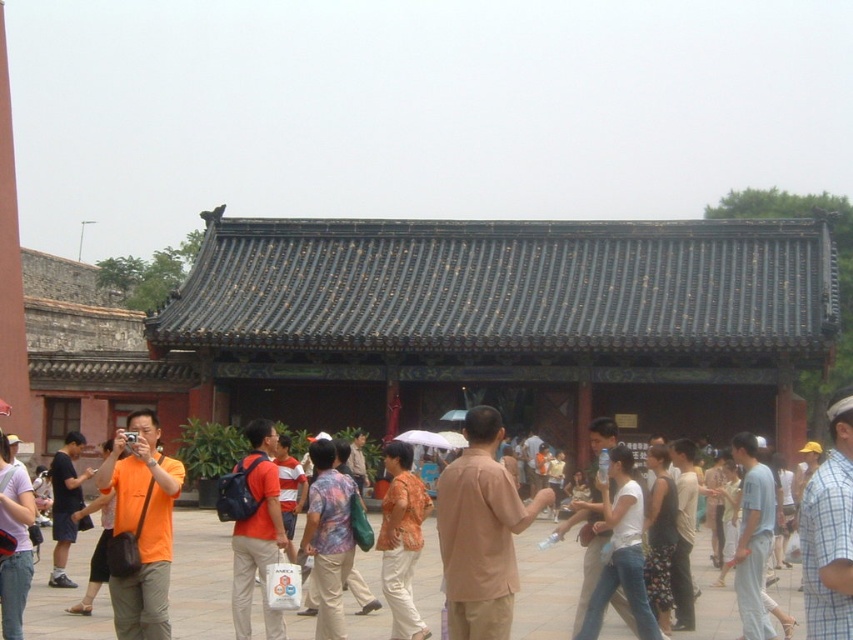
Question: Among these points, which one is farthest from the camera?

Choices:
 (A) (418, 520)
 (B) (653, 452)
 (C) (273, 461)
 (D) (631, 470)

Answer: (C)

Question: Is orange cotton shirt at center smaller than orange fabric backpack at center?

Choices:
 (A) yes
 (B) no

Answer: (B)

Question: Can you confirm if orange fabric backpack at center is positioned above orange t-shirt at left?

Choices:
 (A) no
 (B) yes

Answer: (B)

Question: Which point is closer to the camera?

Choices:
 (A) (410, 545)
 (B) (27, 531)
 (C) (252, 488)
 (D) (56, 484)

Answer: (B)

Question: Is printed cotton shirt at center positioned in front of white cotton shirt at center?

Choices:
 (A) yes
 (B) no

Answer: (A)

Question: Which point appears farthest from the camera in this image?

Choices:
 (A) (16, 468)
 (B) (653, 634)
 (C) (248, 522)
 (D) (109, 464)

Answer: (C)